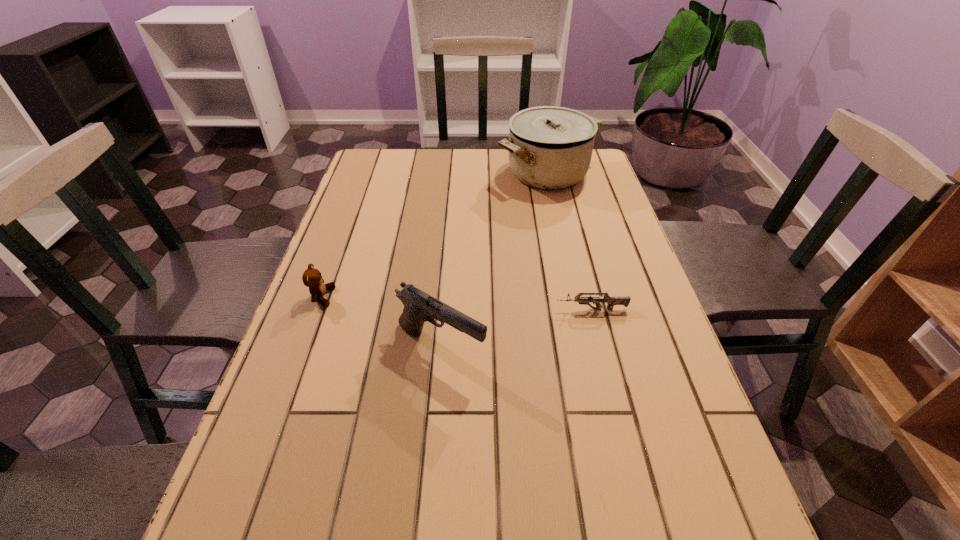
This screenshot has width=960, height=540. I want to click on vacant space located on the front-facing side of the teddy bear, so click(428, 297).

Find the location of a particular element. blank space located 0.190m aimed along the barrel of the shortest object is located at coordinates (471, 309).

Locate an element on the screen. The width and height of the screenshot is (960, 540). free space located 0.350m aimed along the barrel of the shortest object is located at coordinates (400, 309).

I want to click on vacant area situated 0.070m aimed along the barrel of the shortest object, so click(x=525, y=309).

At what (x,y) coordinates should I click in order to perform the action: click on object present at the far edge. Please return your answer as a coordinate pair (x, y). Looking at the image, I should click on (550, 147).

Locate an element on the screen. object present at the left edge is located at coordinates (312, 278).

This screenshot has width=960, height=540. In order to click on saucepan located at the right edge in this screenshot , I will do `click(550, 147)`.

Find the location of a particular element. Image resolution: width=960 pixels, height=540 pixels. gun that is at the right edge is located at coordinates (611, 301).

Locate an element on the screen. object present at the far right corner is located at coordinates (550, 147).

Locate an element on the screen. This screenshot has width=960, height=540. free region at the far edge of the desktop is located at coordinates (473, 151).